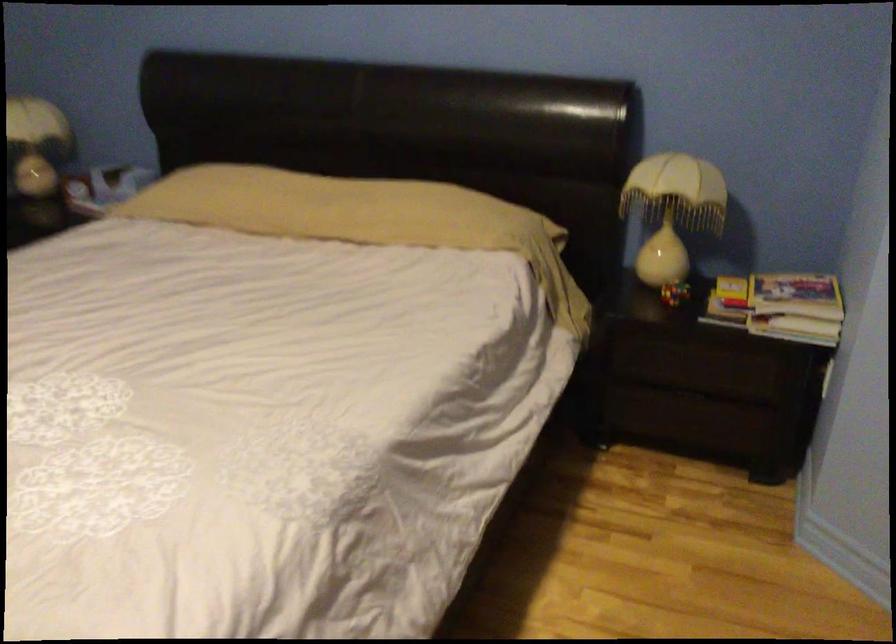
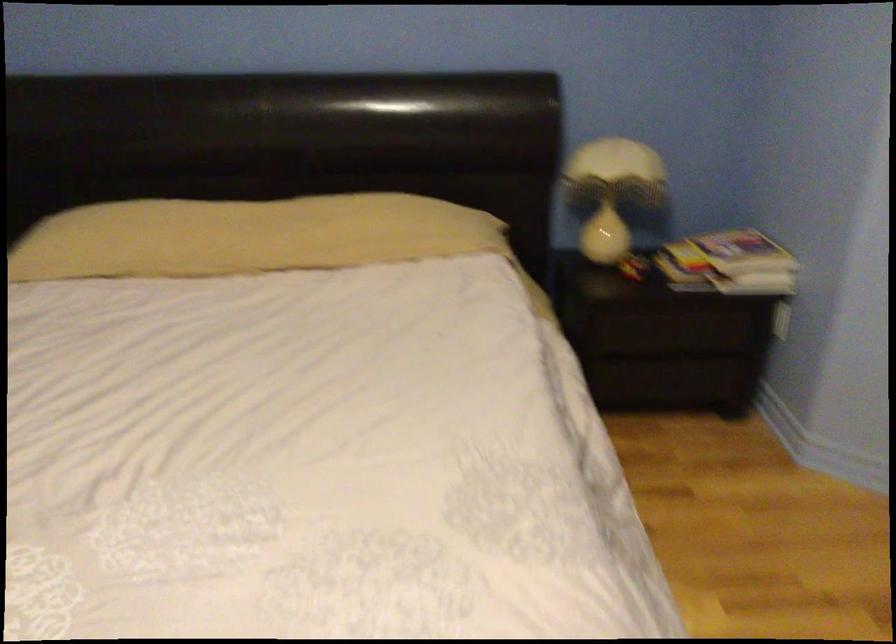
In the second image, find the point that corresponds to pixel 669 214 in the first image.

(613, 191)